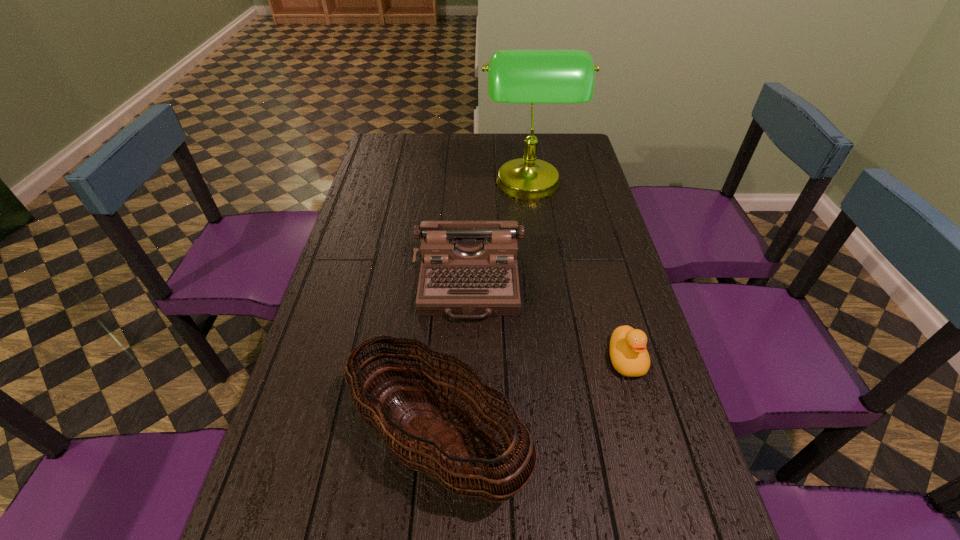
Where is `free space between the shortest object and the typewriter`? free space between the shortest object and the typewriter is located at coordinates (547, 322).

I want to click on empty location between the shortest object and the lamp, so click(x=577, y=273).

Locate which object ranks second in proximity to the lamp. Please provide its 2D coordinates. Your answer should be formatted as a tuple, i.e. [(x, y)], where the tuple contains the x and y coordinates of a point satisfying the conditions above.

[(628, 353)]

At what (x,y) coordinates should I click in order to perform the action: click on object that is the second closest to the tallest object. Please return your answer as a coordinate pair (x, y). The height and width of the screenshot is (540, 960). Looking at the image, I should click on (628, 353).

You are a GUI agent. You are given a task and a screenshot of the screen. Output one action in this format:
    pyautogui.click(x=<x>, y=<y>)
    Task: Click on the free space in the image that satisfies the following two spatial constraints: 1. on the desk next to the lamp; 2. on the keyboard of the typewriter
    Image resolution: width=960 pixels, height=540 pixels.
    Given the screenshot: What is the action you would take?
    pyautogui.click(x=542, y=284)